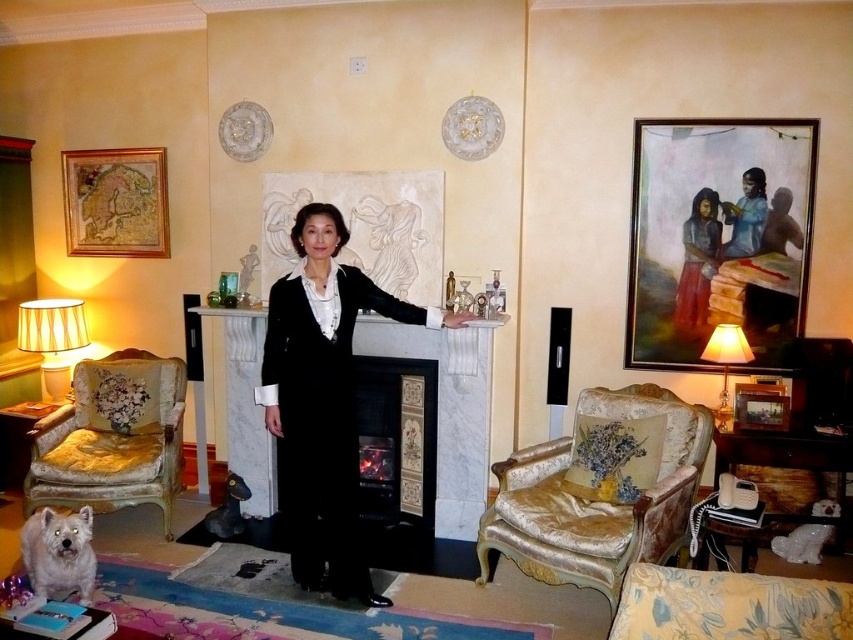
You are an interior designer planning to place a new sofa in the living room. The sofa is 1.8 meters wide. You want to position it between the black tiled fireplace at center and the matte beige lampshade at left. Can the sofa fit in the space between them?

The black tiled fireplace at center has a lesser width compared to matte beige lampshade at left. Therefore, the space between them is wider than the sofa, so it can fit.

You are a guest at a party in this living room and want to take a photo of the white fluffy dog at lower left and the matte red dress at upper right together in the frame. Can you position yourself so that both objects are visible in the same photo without moving either object?

The white fluffy dog at lower left is located below the matte red dress at upper right, so positioning yourself at a central point facing towards them should allow both to be captured in the same frame as their vertical positions are aligned along the same axis.